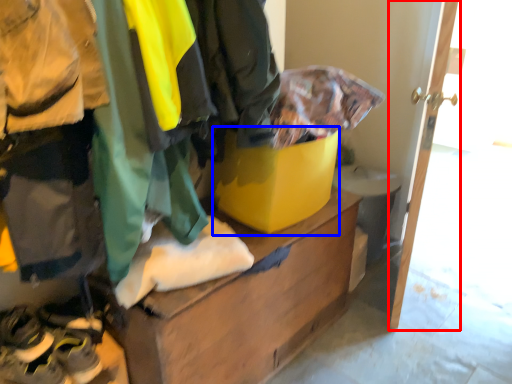
Question: Which point is further to the camera, door (highlighted by a red box) or cardboard box (highlighted by a blue box)?

Choices:
 (A) door
 (B) cardboard box

Answer: (B)